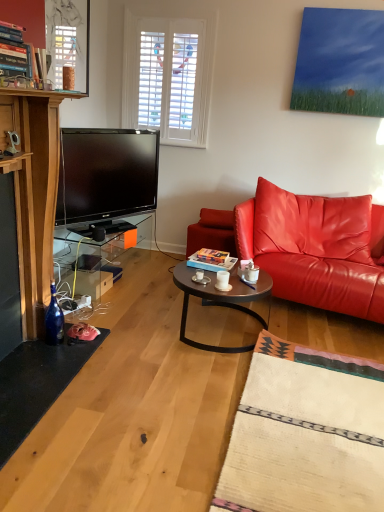
Question: Is point (334, 221) closer or farther from the camera than point (223, 279)?

Choices:
 (A) closer
 (B) farther

Answer: (B)

Question: Based on their sizes in the image, would you say shiny leather couch at right is bigger or smaller than white ceramic mug at center?

Choices:
 (A) big
 (B) small

Answer: (A)

Question: Which object is the closest to the blue glass bottle at lower left?

Choices:
 (A) metallic glass window screen at upper left
 (B) transparent glass table at lower left
 (C) shiny leather couch at right
 (D) metallic round table at center
 (E) white ceramic mug at center

Answer: (B)

Question: Based on their relative distances, which object is nearer to the metallic glass window screen at upper left?

Choices:
 (A) transparent glass table at lower left
 (B) shiny leather couch at right
 (C) metallic round table at center
 (D) white ceramic mug at center
 (E) blue glass bottle at lower left

Answer: (A)